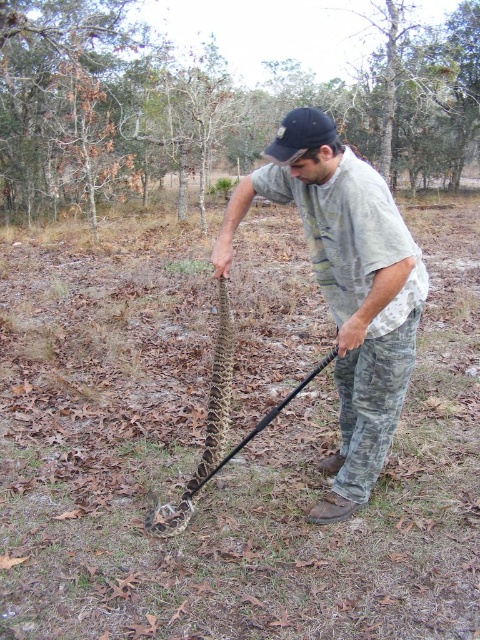
You are a GUI agent. You are given a task and a screenshot of the screen. Output one action in this format:
    pyautogui.click(x=<x>, y=<y>)
    Task: Click on the camouflage pants at center
    This screenshot has width=480, height=640.
    Given the screenshot: What is the action you would take?
    pyautogui.click(x=346, y=285)

Who is more forward, (268, 147) or (156, 531)?

Point (156, 531) is more forward.

Find the location of a particular element. camouflage pants at center is located at coordinates (346, 285).

What do you see at coordinates (212, 104) in the screenshot?
I see `brown textured tree at center` at bounding box center [212, 104].

Can you confirm if brown textured tree at center is bigger than camouflage pants at center?

Yes, brown textured tree at center is bigger than camouflage pants at center.

Is point (357, 131) closer to camera compared to point (345, 460)?

No, it is not.

Where is `brown textured tree at center`? The height and width of the screenshot is (640, 480). brown textured tree at center is located at coordinates (212, 104).

Can you confirm if camouflage-patterned snake at center is bigger than black fabric baseball cap at center?

Incorrect, camouflage-patterned snake at center is not larger than black fabric baseball cap at center.

Does camouflage-patterned snake at center appear under black fabric baseball cap at center?

Yes.

Is point (210, 417) behind point (278, 147)?

Yes.

Locate an element on the screen. The height and width of the screenshot is (640, 480). camouflage-patterned snake at center is located at coordinates tap(205, 429).